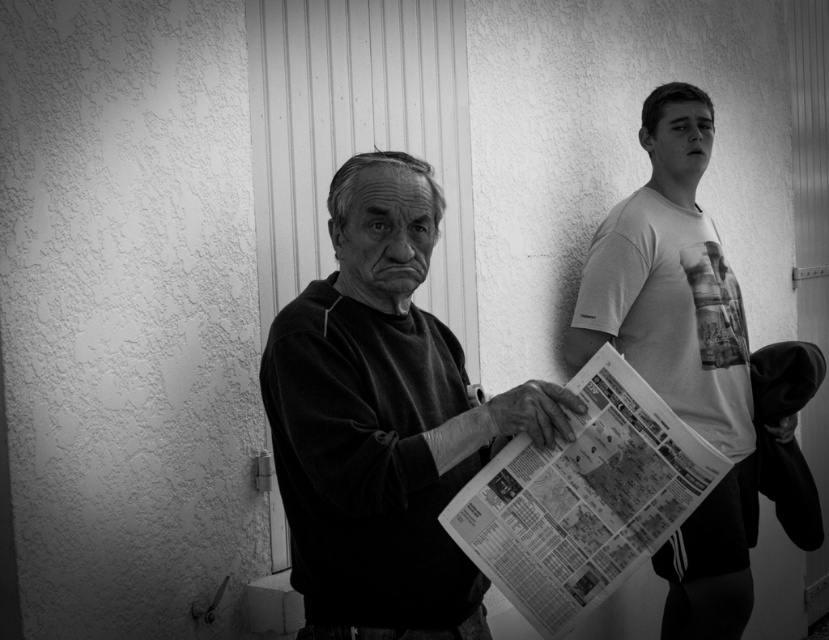
Question: Which of the following is the farthest from the observer?

Choices:
 (A) matte black sweater at center
 (B) printed newspaper at center
 (C) white printed t-shirt at right

Answer: (C)

Question: Estimate the real-world distances between objects in this image. Which object is farther from the white printed t-shirt at right?

Choices:
 (A) matte black sweater at center
 (B) printed newspaper at center

Answer: (A)

Question: Observing the image, what is the correct spatial positioning of matte black sweater at center in reference to white printed t-shirt at right?

Choices:
 (A) below
 (B) above

Answer: (A)

Question: Does matte black sweater at center appear on the right side of white printed t-shirt at right?

Choices:
 (A) yes
 (B) no

Answer: (B)

Question: Based on their relative distances, which object is farther from the matte black sweater at center?

Choices:
 (A) printed newspaper at center
 (B) white printed t-shirt at right

Answer: (B)

Question: Is white printed t-shirt at right thinner than printed newspaper at center?

Choices:
 (A) no
 (B) yes

Answer: (A)